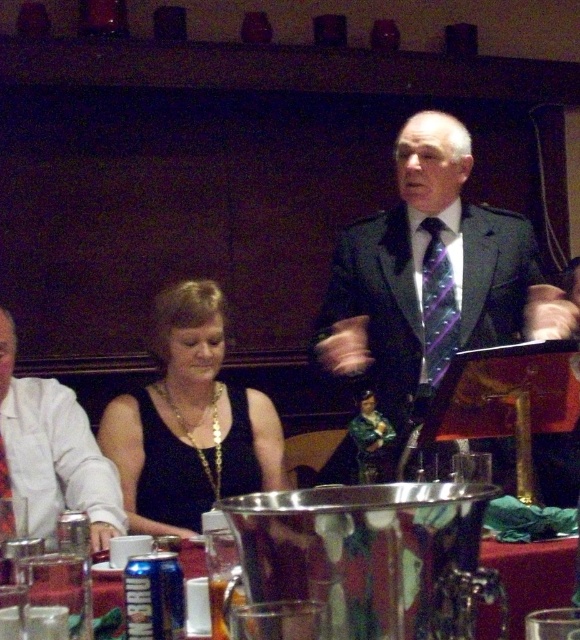
Can you confirm if clear glass table at center is shorter than purple striped tie at center?

Yes.

Does clear glass table at center have a larger size compared to purple striped tie at center?

No, clear glass table at center is not bigger than purple striped tie at center.

Is point (180, 560) positioned after point (444, 250)?

No, (180, 560) is in front of (444, 250).

Where is `clear glass table at center`? clear glass table at center is located at coordinates (531, 576).

Is black satin dress at center closer to camera compared to purple striped tie at center?

Yes, it is.

Can you confirm if black satin dress at center is positioned to the left of purple striped tie at center?

Indeed, black satin dress at center is positioned on the left side of purple striped tie at center.

This screenshot has width=580, height=640. What do you see at coordinates (190, 422) in the screenshot? I see `black satin dress at center` at bounding box center [190, 422].

Locate an element on the screen. black satin dress at center is located at coordinates (190, 422).

Is black satin dress at center bigger than clear glass table at center?

Yes, black satin dress at center is bigger than clear glass table at center.

Does black satin dress at center have a greater height compared to clear glass table at center?

Yes.

Is point (215, 467) positioned before point (549, 573)?

That is False.

Locate an element on the screen. The image size is (580, 640). black satin dress at center is located at coordinates (190, 422).